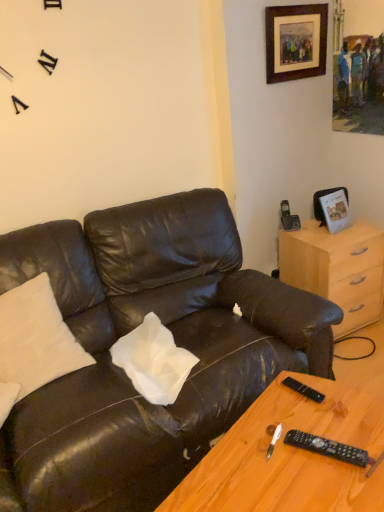
Identify the location of free point in front of black plastic remote at lower right, which is the second remote from top to bottom. This screenshot has height=512, width=384. (337, 487).